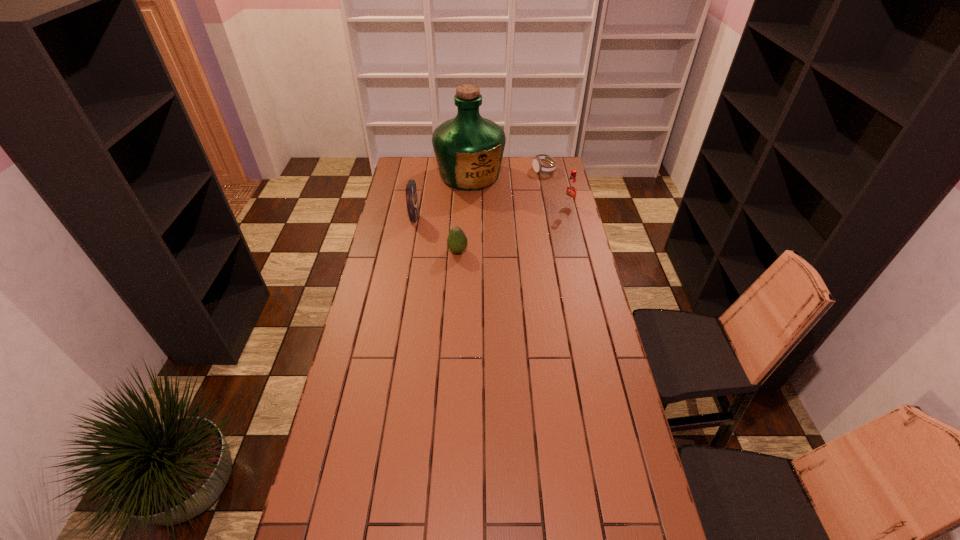
Select which object is the third closest to the shortest object. Please provide its 2D coordinates. Your answer should be formatted as a tuple, i.e. [(x, y)], where the tuple contains the x and y coordinates of a point satisfying the conditions above.

[(411, 190)]

The image size is (960, 540). I want to click on vacant area in the image that satisfies the following two spatial constraints: 1. on the back side of the tallest object; 2. on the right side of the nearest object, so click(x=462, y=176).

Image resolution: width=960 pixels, height=540 pixels. I want to click on vacant region that satisfies the following two spatial constraints: 1. on the back side of the fourth farthest object; 2. on the right side of the shortest object, so click(423, 170).

Identify the location of free space that satisfies the following two spatial constraints: 1. on the back side of the fourth farthest object; 2. on the left side of the watch. (423, 170).